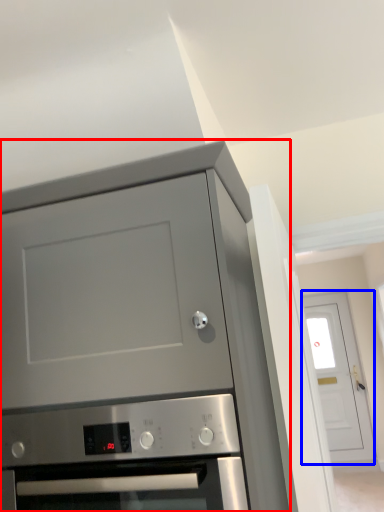
Question: Which object appears farthest to the camera in this image, cabinetry (highlighted by a red box) or door (highlighted by a blue box)?

Choices:
 (A) cabinetry
 (B) door

Answer: (B)